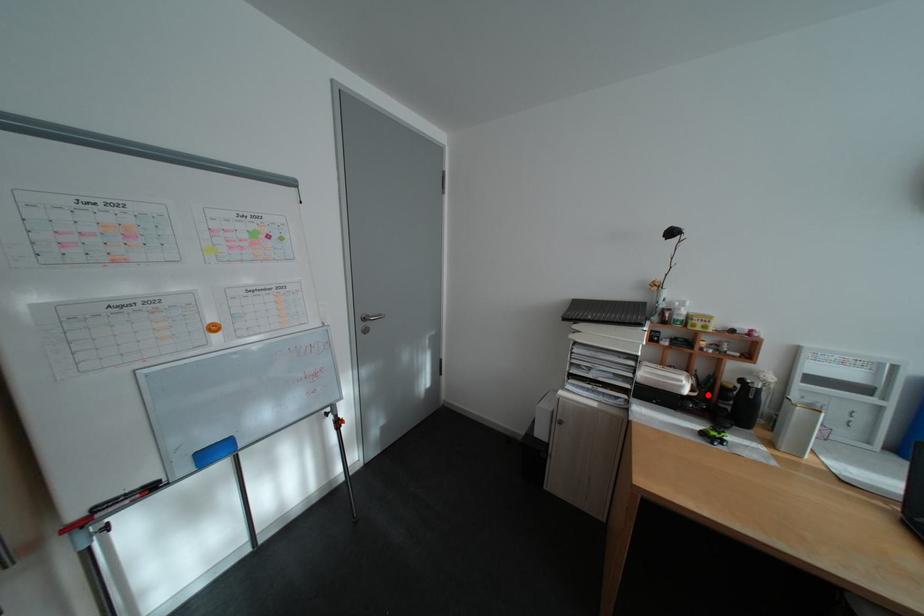
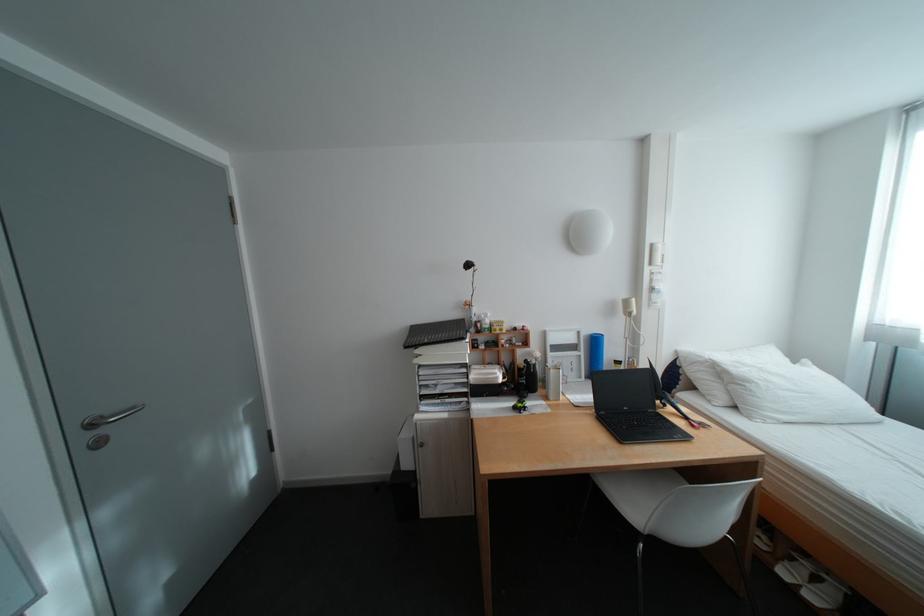
Where in the second image is the point corresponding to the highlighted location from the first image?

(518, 381)